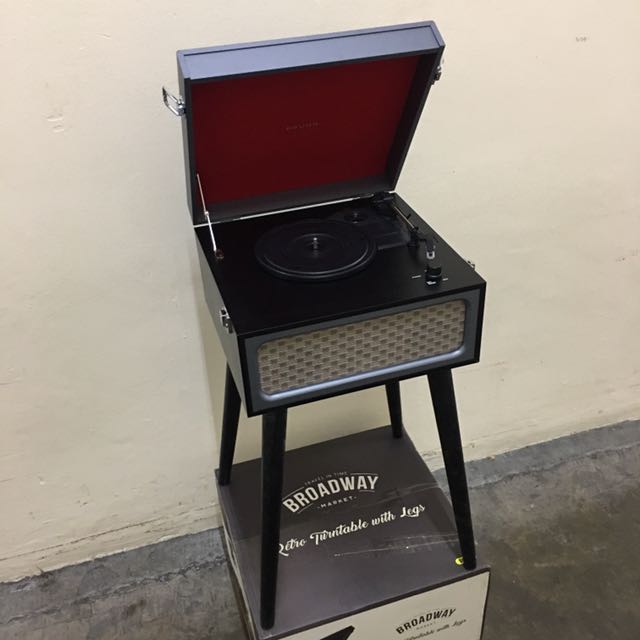
You are a GUI agent. You are given a task and a screenshot of the screen. Output one action in this format:
    pyautogui.click(x=<x>, y=<y>)
    Task: Click on the turntable
    The width and height of the screenshot is (640, 640).
    Given the screenshot: What is the action you would take?
    pyautogui.click(x=344, y=244)